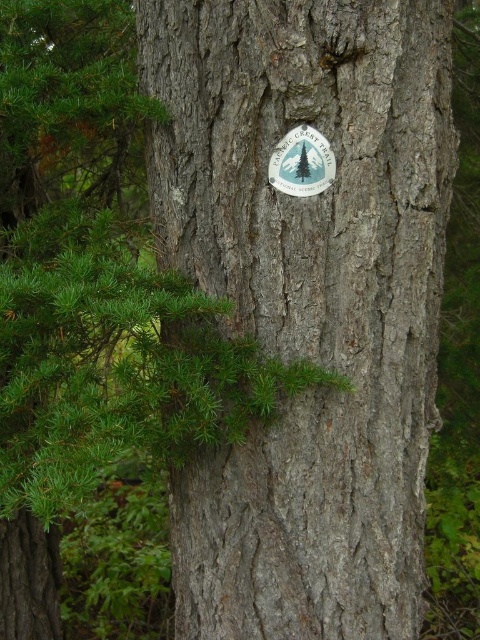
The height and width of the screenshot is (640, 480). Describe the element at coordinates (308, 300) in the screenshot. I see `gray rough bark tree trunk at center` at that location.

Is point (396, 605) positioned behind point (285, 134)?

Yes, point (396, 605) is behind point (285, 134).

Identify the location of gray rough bark tree trunk at center. This screenshot has width=480, height=640. (308, 300).